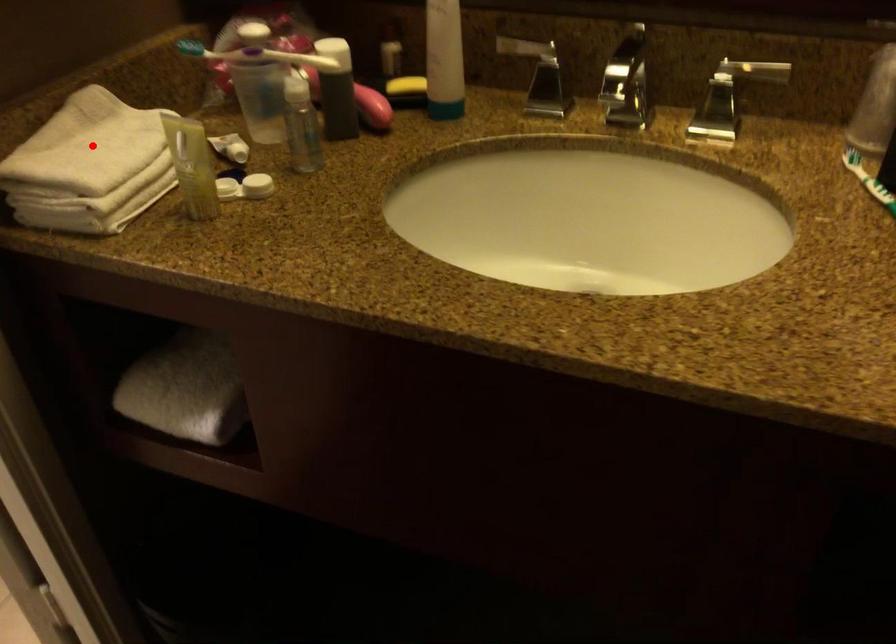
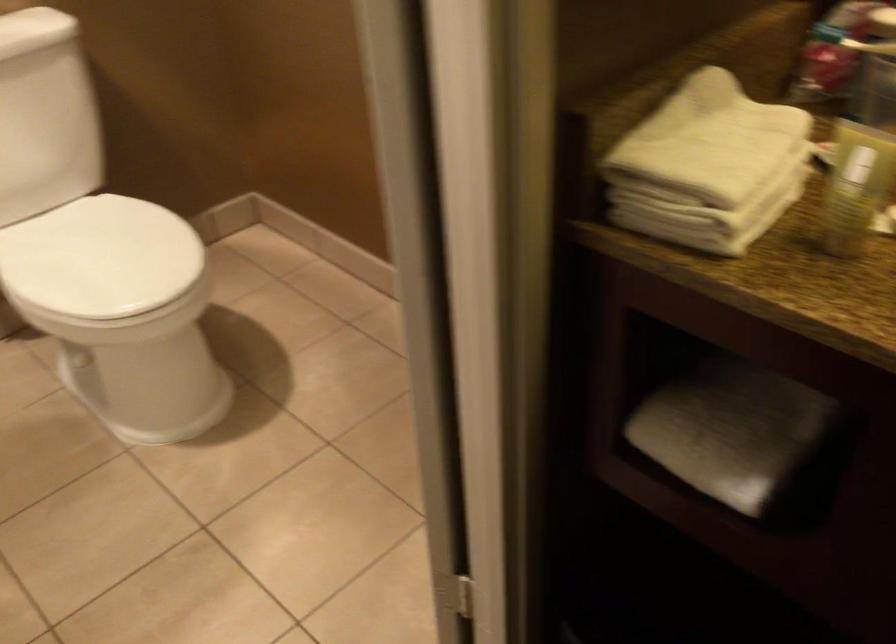
Find the pixel in the second image that matches the highlighted location in the first image.

(711, 140)